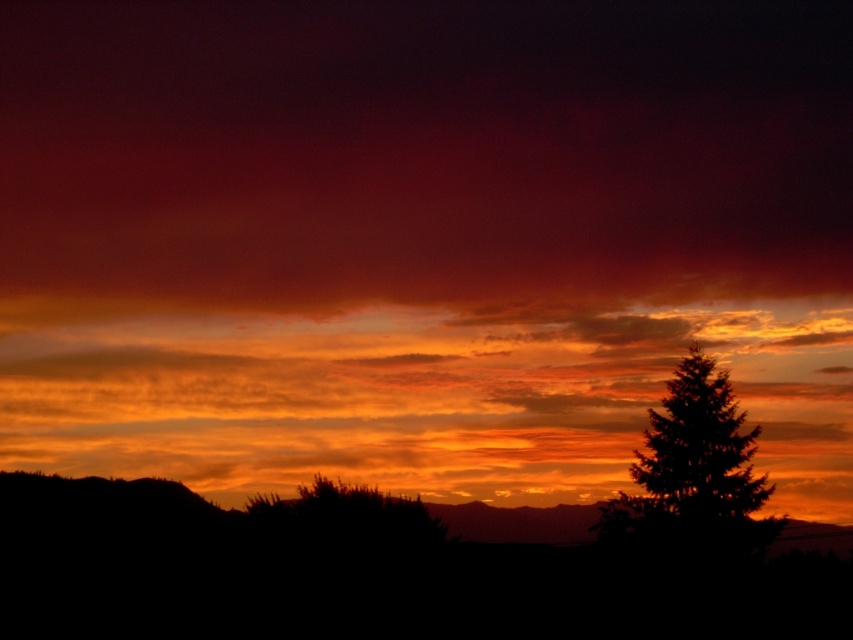
You are an artist trying to paint the sunset scene. You need to decide the placement of the orange translucent clouds at center and the green textured tree at right. According to the scene, which object should be placed lower in the painting?

The orange translucent clouds at center should be placed lower than the green textured tree at right because the description states that the orange translucent clouds at center is below green textured tree at right.

You are an artist trying to sketch the sunset scene. You notice the orange translucent clouds at center and the green textured tree at right. Which object should you draw first to maintain proper perspective? Please explain your reasoning based on their positions.

You should draw the orange translucent clouds at center first because they are positioned to the left of the green textured tree at right. In perspective drawing, objects that are farther away are often placed behind closer objects, so starting with the clouds ensures they can be layered appropriately behind the tree.

You are standing in the sunset scene and want to walk from point A to point B. Point A is at coordinate point (227,424) and point B is at coordinate point (627,497). Since you can only move forward, will you reach point B before point A?

Point (227,424) is further to the viewer than point (627,497). Therefore, you will reach point B before point A since it is closer to you.